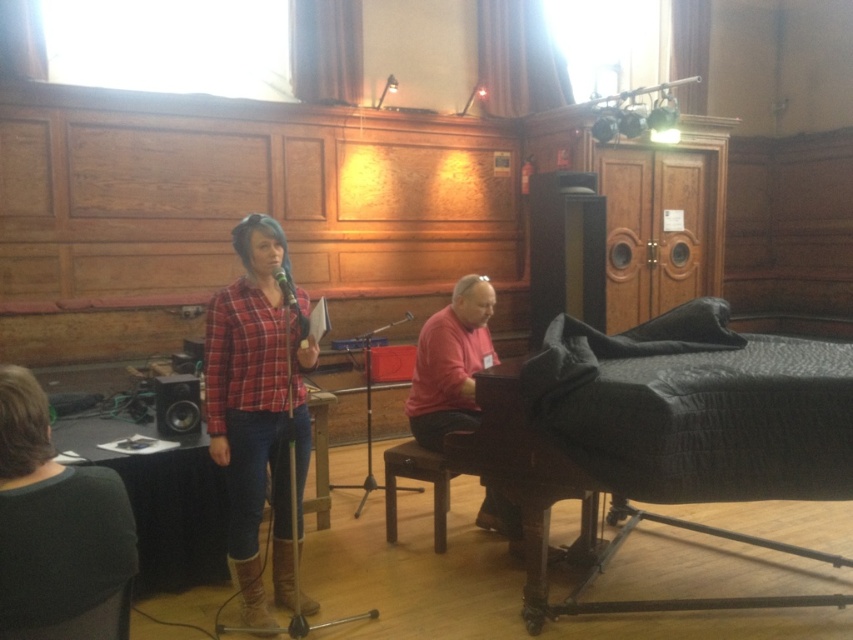
Question: Which object is closer to the camera taking this photo?

Choices:
 (A) plaid shirt at center
 (B) black textured piano at right
 (C) pink matte shirt at center

Answer: (B)

Question: Is plaid shirt at center to the right of pink matte shirt at center from the viewer's perspective?

Choices:
 (A) no
 (B) yes

Answer: (A)

Question: Is plaid shirt at center closer to camera compared to matte black microphone at center?

Choices:
 (A) yes
 (B) no

Answer: (B)

Question: Where is plaid shirt at center located in relation to black textured piano at right in the image?

Choices:
 (A) below
 (B) above

Answer: (B)

Question: Which object appears closest to the camera in this image?

Choices:
 (A) plaid shirt at center
 (B) black textured piano at right

Answer: (B)

Question: Which point appears farthest from the camera in this image?

Choices:
 (A) (225, 467)
 (B) (438, 372)
 (C) (514, 364)
 (D) (283, 269)

Answer: (B)